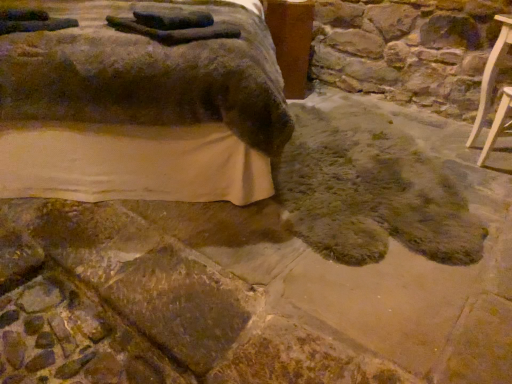
Question: From a real-world perspective, does brown wood table at upper center sit lower than brown textured mattress at lower left, which is the 2th furniture from right to left?

Choices:
 (A) no
 (B) yes

Answer: (B)

Question: Is brown wood table at upper center wider than brown textured mattress at lower left, which is the 2th furniture from right to left?

Choices:
 (A) yes
 (B) no

Answer: (B)

Question: From the image's perspective, is brown wood table at upper center on brown textured mattress at lower left, which is the 2th furniture from right to left?

Choices:
 (A) yes
 (B) no

Answer: (A)

Question: Does brown wood table at upper center come in front of brown textured mattress at lower left, which is the 2th furniture from right to left?

Choices:
 (A) yes
 (B) no

Answer: (B)

Question: Is brown wood table at upper center not within brown textured mattress at lower left, which is the 2th furniture from right to left?

Choices:
 (A) no
 (B) yes

Answer: (A)

Question: Is brown wood table at upper center facing towards brown textured mattress at lower left, acting as the first furniture starting from the left?

Choices:
 (A) yes
 (B) no

Answer: (B)

Question: Is the depth of brown wood table at upper center greater than that of fuzzy brown rug at lower center?

Choices:
 (A) yes
 (B) no

Answer: (A)

Question: From a real-world perspective, is brown wood table at upper center located beneath fuzzy brown rug at lower center?

Choices:
 (A) no
 (B) yes

Answer: (A)

Question: Considering the relative sizes of brown wood table at upper center and fuzzy brown rug at lower center in the image provided, is brown wood table at upper center taller than fuzzy brown rug at lower center?

Choices:
 (A) yes
 (B) no

Answer: (A)

Question: From the image's perspective, is brown wood table at upper center below fuzzy brown rug at lower center?

Choices:
 (A) no
 (B) yes

Answer: (A)

Question: Does brown wood table at upper center turn towards fuzzy brown rug at lower center?

Choices:
 (A) no
 (B) yes

Answer: (B)

Question: From the image's perspective, is brown wood table at upper center on top of fuzzy brown rug at lower center?

Choices:
 (A) yes
 (B) no

Answer: (A)

Question: From a real-world perspective, does fuzzy brown rug at lower center sit lower than brown textured mattress at lower left, acting as the first furniture starting from the left?

Choices:
 (A) no
 (B) yes

Answer: (B)